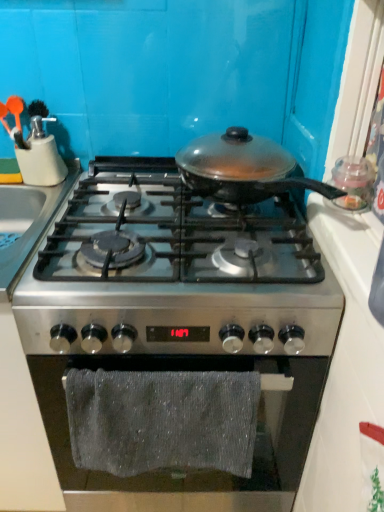
At what (x,y) coordinates should I click in order to perform the action: click on stainless steel gas stove at center, the first gas stove in the bottom-to-top sequence. Please return your answer as a coordinate pair (x, y). The height and width of the screenshot is (512, 384). Looking at the image, I should click on (177, 340).

Based on the photo, measure the distance between gray textured towel at lower center and camera.

The distance of gray textured towel at lower center from camera is 31.24 inches.

Where is `stainless steel gas stove at center, the second gas stove ordered from the bottom`? stainless steel gas stove at center, the second gas stove ordered from the bottom is located at coordinates (173, 233).

How far apart are gray textured towel at lower center and stainless steel gas stove at center, the first gas stove in the bottom-to-top sequence?

The distance of gray textured towel at lower center from stainless steel gas stove at center, the first gas stove in the bottom-to-top sequence, is 4.04 inches.

From the picture: Considering the sizes of gray textured towel at lower center and stainless steel gas stove at center, the first gas stove in the bottom-to-top sequence, in the image, is gray textured towel at lower center bigger or smaller than stainless steel gas stove at center, the first gas stove in the bottom-to-top sequence,?

Clearly, gray textured towel at lower center is smaller in size than stainless steel gas stove at center, the first gas stove in the bottom-to-top sequence.

Choose the correct answer: Is gray textured towel at lower center inside stainless steel gas stove at center, which is the 2th gas stove from top to bottom, or outside it?

gray textured towel at lower center is enclosed within stainless steel gas stove at center, which is the 2th gas stove from top to bottom.

From the image's perspective, is gray textured towel at lower center under stainless steel gas stove at center, which is the 2th gas stove from top to bottom?

Yes, from the image's perspective, gray textured towel at lower center is below stainless steel gas stove at center, which is the 2th gas stove from top to bottom.

Is matte plastic utensil holder at upper left surrounded by gray textured towel at lower center?

Definitely not — matte plastic utensil holder at upper left is not inside gray textured towel at lower center.

Between point (76, 393) and point (54, 159), which one is positioned behind?

The point (54, 159) is farther from the camera.

Can you confirm if gray textured towel at lower center is shorter than matte plastic utensil holder at upper left?

In fact, gray textured towel at lower center may be taller than matte plastic utensil holder at upper left.

Could you measure the distance between matte plastic utensil holder at upper left and gray textured towel at lower center?

matte plastic utensil holder at upper left is 26.96 inches from gray textured towel at lower center.

Between matte plastic utensil holder at upper left and gray textured towel at lower center, which one appears on the left side from the viewer's perspective?

Positioned to the left is matte plastic utensil holder at upper left.

Is the position of matte plastic utensil holder at upper left more distant than that of gray textured towel at lower center?

Yes.

Could you tell me if stainless steel gas stove at center, the first gas stove in the bottom-to-top sequence, is turned towards matte plastic utensil holder at upper left?

No, stainless steel gas stove at center, the first gas stove in the bottom-to-top sequence, is not oriented towards matte plastic utensil holder at upper left.

Which of these two, stainless steel gas stove at center, which is the 2th gas stove from top to bottom, or matte plastic utensil holder at upper left, is thinner?

matte plastic utensil holder at upper left.

From the image's perspective, would you say stainless steel gas stove at center, the first gas stove in the bottom-to-top sequence, is shown under matte plastic utensil holder at upper left?

Correct, stainless steel gas stove at center, the first gas stove in the bottom-to-top sequence, appears lower than matte plastic utensil holder at upper left in the image.

Locate an element on the screen. The image size is (384, 512). the 2nd gas stove below the matte plastic utensil holder at upper left (from the image's perspective) is located at coordinates (177, 340).

The image size is (384, 512). I want to click on the 1st gas stove in front of the matte plastic utensil holder at upper left, counting from the anchor's position, so click(177, 340).

From a real-world perspective, is matte plastic utensil holder at upper left below stainless steel gas stove at center, which is the 2th gas stove from top to bottom?

No.

Is point (45, 162) behind point (295, 369)?

Yes.

Are matte plastic utensil holder at upper left and stainless steel gas stove at center, the first gas stove in the bottom-to-top sequence, located far from each other?

That's not correct — matte plastic utensil holder at upper left is a little close to stainless steel gas stove at center, the first gas stove in the bottom-to-top sequence.

Could you measure the distance between matte plastic utensil holder at upper left and stainless steel gas stove at center, the second gas stove ordered from the bottom?

14.60 inches.

Who is more distant, matte plastic utensil holder at upper left or stainless steel gas stove at center, the second gas stove ordered from the bottom?

matte plastic utensil holder at upper left is behind.

Is matte plastic utensil holder at upper left oriented away from stainless steel gas stove at center, the second gas stove ordered from the bottom?

matte plastic utensil holder at upper left is not turned away from stainless steel gas stove at center, the second gas stove ordered from the bottom.

Does point (39, 120) appear closer or farther from the camera than point (124, 242)?

Point (39, 120) is farther from the camera than point (124, 242).

Which of these two, stainless steel gas stove at center, the second gas stove ordered from the bottom, or stainless steel gas stove at center, which is the 2th gas stove from top to bottom, is bigger?

stainless steel gas stove at center, which is the 2th gas stove from top to bottom, is bigger.

Is stainless steel gas stove at center, which is the first gas stove in top-to-bottom order, aimed at stainless steel gas stove at center, which is the 2th gas stove from top to bottom?

No, stainless steel gas stove at center, which is the first gas stove in top-to-bottom order, is not aimed at stainless steel gas stove at center, which is the 2th gas stove from top to bottom.

In the scene shown: Is stainless steel gas stove at center, the second gas stove ordered from the bottom, wider than stainless steel gas stove at center, the first gas stove in the bottom-to-top sequence?

Incorrect, the width of stainless steel gas stove at center, the second gas stove ordered from the bottom, does not surpass that of stainless steel gas stove at center, the first gas stove in the bottom-to-top sequence.

Where is `bath towel lying in front of the stainless steel gas stove at center, which is the 2th gas stove from top to bottom`? This screenshot has height=512, width=384. bath towel lying in front of the stainless steel gas stove at center, which is the 2th gas stove from top to bottom is located at coordinates 162,420.

Find the location of a particular element. kitchen appliance located behind the gray textured towel at lower center is located at coordinates (39, 156).

From the image, which object appears to be nearer to stainless steel gas stove at center, which is the first gas stove in top-to-bottom order, gray textured towel at lower center or stainless steel gas stove at center, the first gas stove in the bottom-to-top sequence?

stainless steel gas stove at center, the first gas stove in the bottom-to-top sequence, lies closer to stainless steel gas stove at center, which is the first gas stove in top-to-bottom order, than the other object.

From the image, which object appears to be nearer to matte plastic utensil holder at upper left, stainless steel gas stove at center, the first gas stove in the bottom-to-top sequence, or stainless steel gas stove at center, which is the first gas stove in top-to-bottom order?

stainless steel gas stove at center, which is the first gas stove in top-to-bottom order.

Estimate the real-world distances between objects in this image. Which object is closer to matte plastic utensil holder at upper left, stainless steel gas stove at center, the second gas stove ordered from the bottom, or gray textured towel at lower center?

stainless steel gas stove at center, the second gas stove ordered from the bottom.

Based on their spatial positions, is stainless steel gas stove at center, the first gas stove in the bottom-to-top sequence, or matte plastic utensil holder at upper left further from gray textured towel at lower center?

The object further to gray textured towel at lower center is matte plastic utensil holder at upper left.

When comparing their distances from stainless steel gas stove at center, the second gas stove ordered from the bottom, does matte plastic utensil holder at upper left or gray textured towel at lower center seem further?

matte plastic utensil holder at upper left lies further to stainless steel gas stove at center, the second gas stove ordered from the bottom, than the other object.

When comparing their distances from stainless steel gas stove at center, which is the 2th gas stove from top to bottom, does matte plastic utensil holder at upper left or gray textured towel at lower center seem closer?

gray textured towel at lower center is closer to stainless steel gas stove at center, which is the 2th gas stove from top to bottom.

When comparing their distances from stainless steel gas stove at center, which is the 2th gas stove from top to bottom, does gray textured towel at lower center or matte plastic utensil holder at upper left seem further?

The object further to stainless steel gas stove at center, which is the 2th gas stove from top to bottom, is matte plastic utensil holder at upper left.

From the image, which object appears to be nearer to stainless steel gas stove at center, which is the 2th gas stove from top to bottom, stainless steel gas stove at center, the second gas stove ordered from the bottom, or matte plastic utensil holder at upper left?

Among the two, stainless steel gas stove at center, the second gas stove ordered from the bottom, is located nearer to stainless steel gas stove at center, which is the 2th gas stove from top to bottom.

Where is `gas stove between matte plastic utensil holder at upper left and stainless steel gas stove at center, which is the 2th gas stove from top to bottom, in the vertical direction`? This screenshot has width=384, height=512. gas stove between matte plastic utensil holder at upper left and stainless steel gas stove at center, which is the 2th gas stove from top to bottom, in the vertical direction is located at coordinates (173, 233).

Image resolution: width=384 pixels, height=512 pixels. I want to click on gas stove between stainless steel gas stove at center, which is the first gas stove in top-to-bottom order, and gray textured towel at lower center, in the vertical direction, so click(177, 340).